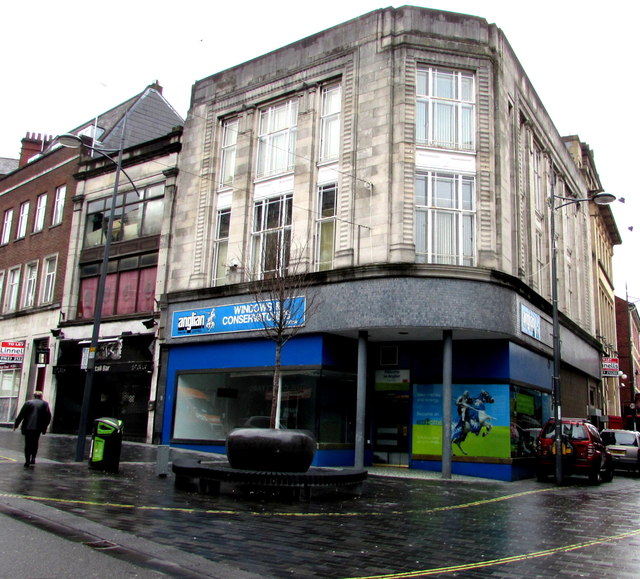
Locate an element on the screen. large black plant pot is located at coordinates (291, 458).